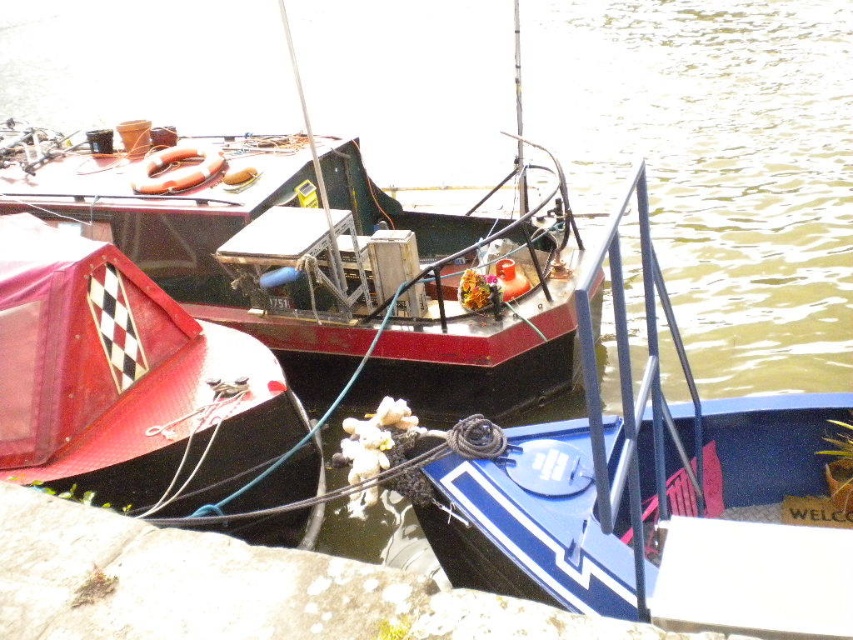
Question: Which point appears farthest from the camera in this image?

Choices:
 (A) (323, 188)
 (B) (126, 454)

Answer: (A)

Question: Is matte red boat at left thinner than blue glossy boat at center?

Choices:
 (A) no
 (B) yes

Answer: (B)

Question: Which point is farther to the camera?

Choices:
 (A) (397, 369)
 (B) (62, 378)

Answer: (A)

Question: Among these points, which one is farthest from the camera?

Choices:
 (A) (384, 236)
 (B) (744, 566)
 (C) (20, 388)

Answer: (A)

Question: Does blue glossy boat at center appear on the left side of red matte boat at left?

Choices:
 (A) no
 (B) yes

Answer: (A)

Question: Can you confirm if matte red boat at left is bigger than blue glossy boat at center?

Choices:
 (A) yes
 (B) no

Answer: (B)